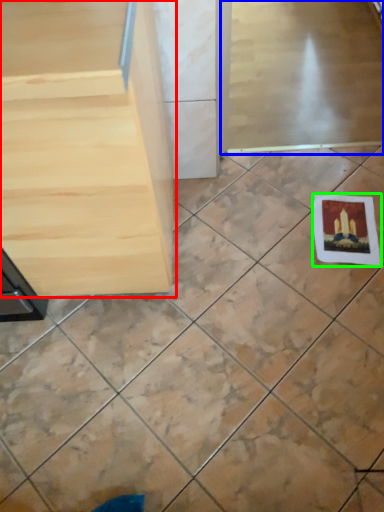
Question: Based on their relative distances, which object is nearer to furniture (highlighted by a red box)? Choose from screen door (highlighted by a blue box) and postcard (highlighted by a green box).

Choices:
 (A) screen door
 (B) postcard

Answer: (B)